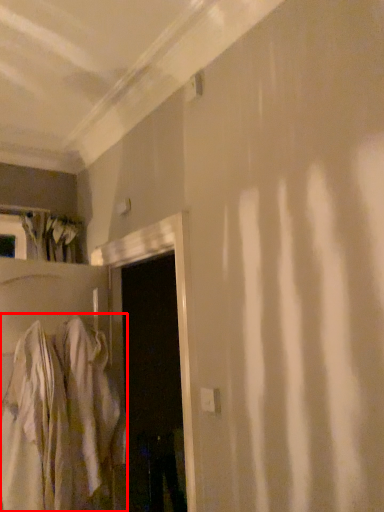
Question: From the image's perspective, where is robe (annotated by the red box) located in relation to door in the image?

Choices:
 (A) below
 (B) above

Answer: (A)